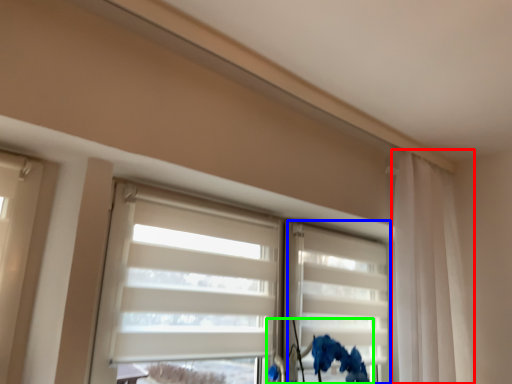
Question: Estimate the real-world distances between objects in this image. Which object is closer to curtain (highlighted by a red box), shutter (highlighted by a blue box) or floral arrangement (highlighted by a green box)?

Choices:
 (A) shutter
 (B) floral arrangement

Answer: (A)